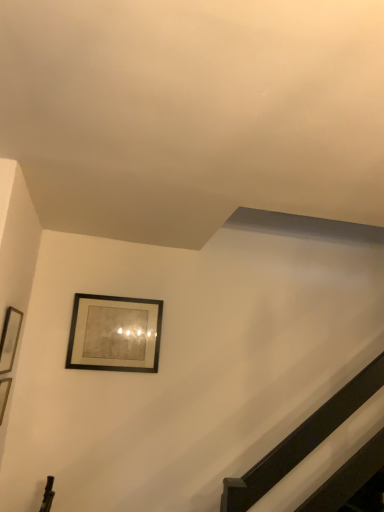
Question: Should I look upward or downward to see matte black picture frame at left, the 1th picture frame in the front-to-back sequence?

Choices:
 (A) up
 (B) down

Answer: (B)

Question: Does matte black picture frame at upper center, the second picture frame positioned from the front, turn towards matte black picture frame at left, placed as the 2th picture frame when sorted from right to left?

Choices:
 (A) yes
 (B) no

Answer: (B)

Question: Is matte black picture frame at upper center, arranged as the first picture frame when viewed from the back, taller than matte black picture frame at left, the 1th picture frame from the left?

Choices:
 (A) yes
 (B) no

Answer: (A)

Question: Can you confirm if matte black picture frame at upper center, the second picture frame in the left-to-right sequence, is thinner than matte black picture frame at left, placed as the 2th picture frame when sorted from right to left?

Choices:
 (A) yes
 (B) no

Answer: (B)

Question: From the image's perspective, is matte black picture frame at upper center, the second picture frame in the left-to-right sequence, above matte black picture frame at left, placed as the 2th picture frame when sorted from right to left?

Choices:
 (A) yes
 (B) no

Answer: (B)

Question: Does matte black picture frame at upper center, the second picture frame positioned from the front, have a greater width compared to matte black picture frame at left, the 1th picture frame in the front-to-back sequence?

Choices:
 (A) yes
 (B) no

Answer: (A)

Question: From the image's perspective, is matte black picture frame at upper center, arranged as the first picture frame when viewed from the back, located beneath matte black picture frame at left, which appears as the 2th picture frame when viewed from the back?

Choices:
 (A) yes
 (B) no

Answer: (A)

Question: Is matte black picture frame at left, which appears as the 2th picture frame when viewed from the back, positioned in front of matte black picture frame at upper center, the second picture frame positioned from the front?

Choices:
 (A) yes
 (B) no

Answer: (A)

Question: Is matte black picture frame at left, the 1th picture frame in the front-to-back sequence, at the left side of matte black picture frame at upper center, arranged as the first picture frame when viewed from the right?

Choices:
 (A) yes
 (B) no

Answer: (A)

Question: From the image's perspective, is matte black picture frame at left, placed as the 2th picture frame when sorted from right to left, below matte black picture frame at upper center, the second picture frame positioned from the front?

Choices:
 (A) yes
 (B) no

Answer: (B)

Question: Does matte black picture frame at left, placed as the 2th picture frame when sorted from right to left, have a lesser height compared to matte black picture frame at upper center, arranged as the first picture frame when viewed from the back?

Choices:
 (A) yes
 (B) no

Answer: (A)

Question: Considering the relative sizes of matte black picture frame at left, which appears as the 2th picture frame when viewed from the back, and matte black picture frame at upper center, the second picture frame positioned from the front, in the image provided, is matte black picture frame at left, which appears as the 2th picture frame when viewed from the back, wider than matte black picture frame at upper center, the second picture frame positioned from the front,?

Choices:
 (A) yes
 (B) no

Answer: (B)

Question: Does matte black picture frame at left, the 1th picture frame from the left, have a smaller size compared to matte black picture frame at upper center, arranged as the first picture frame when viewed from the back?

Choices:
 (A) no
 (B) yes

Answer: (B)

Question: Considering the positions of matte black picture frame at left, placed as the 2th picture frame when sorted from right to left, and matte black picture frame at upper center, the second picture frame in the left-to-right sequence, in the image, is matte black picture frame at left, placed as the 2th picture frame when sorted from right to left, bigger or smaller than matte black picture frame at upper center, the second picture frame in the left-to-right sequence,?

Choices:
 (A) small
 (B) big

Answer: (A)